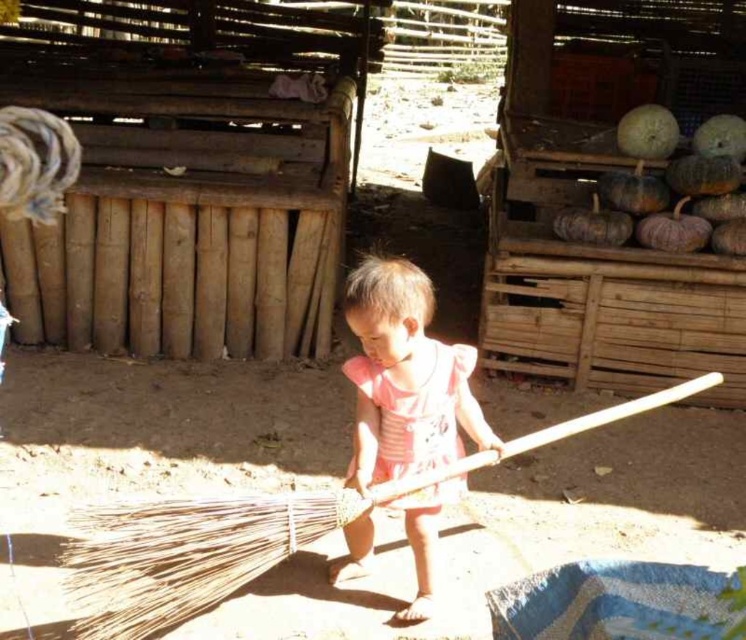
Question: Can you confirm if bamboo broom at center is smaller than pink fabric dress at center?

Choices:
 (A) no
 (B) yes

Answer: (A)

Question: Which of the following is the closest to the observer?

Choices:
 (A) (382, 376)
 (B) (134, 557)

Answer: (B)

Question: Does bamboo broom at center have a larger size compared to pink fabric dress at center?

Choices:
 (A) no
 (B) yes

Answer: (B)

Question: Is bamboo broom at center to the left of pink fabric dress at center from the viewer's perspective?

Choices:
 (A) no
 (B) yes

Answer: (A)

Question: Which point is farther to the camera?

Choices:
 (A) pink fabric dress at center
 (B) bamboo broom at center

Answer: (A)

Question: Among these points, which one is farthest from the camera?

Choices:
 (A) (467, 368)
 (B) (385, 481)

Answer: (B)